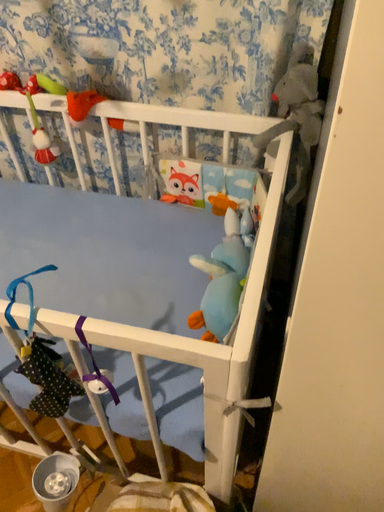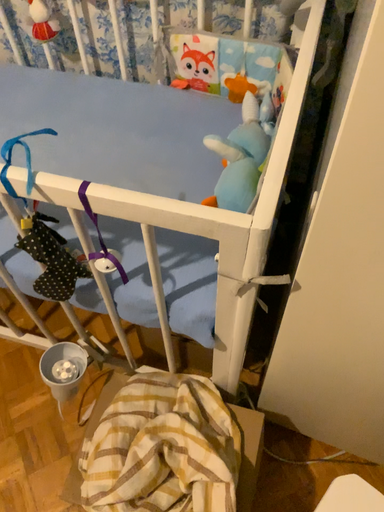
Question: How did the camera likely rotate when shooting the video?

Choices:
 (A) rotated downward
 (B) rotated upward

Answer: (A)